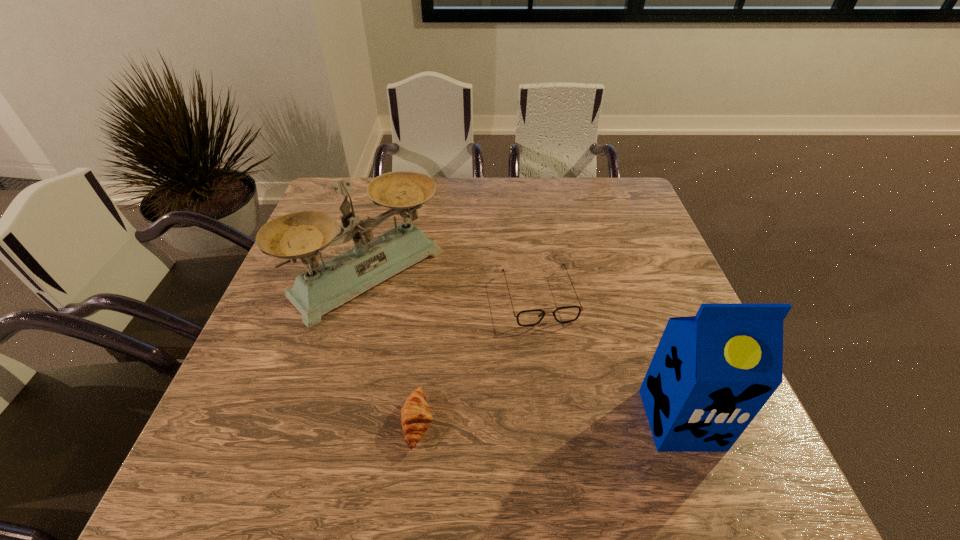
What are the coordinates of `free space located on the front-facing side of the sunglasses` in the screenshot? It's located at (559, 363).

The width and height of the screenshot is (960, 540). I want to click on free space located on the front-facing side of the sunglasses, so click(x=563, y=375).

This screenshot has width=960, height=540. Identify the location of pastry positioned at the near edge. (416, 416).

I want to click on carton at the near edge, so click(x=711, y=374).

The width and height of the screenshot is (960, 540). In order to click on object at the left edge in this screenshot , I will do `click(323, 287)`.

Where is `object that is at the right edge`? object that is at the right edge is located at coordinates (711, 374).

At what (x,y) coordinates should I click in order to perform the action: click on object at the near right corner. Please return your answer as a coordinate pair (x, y). Image resolution: width=960 pixels, height=540 pixels. Looking at the image, I should click on (711, 374).

This screenshot has width=960, height=540. I want to click on free spot at the far edge of the desktop, so click(565, 185).

You are a GUI agent. You are given a task and a screenshot of the screen. Output one action in this format:
    pyautogui.click(x=<x>, y=<y>)
    Task: Click on the free space at the left edge of the desktop
    
    Given the screenshot: What is the action you would take?
    pyautogui.click(x=332, y=321)

The image size is (960, 540). In the image, there is a desktop. Find the location of `vacant space at the far left corner`. vacant space at the far left corner is located at coordinates (352, 197).